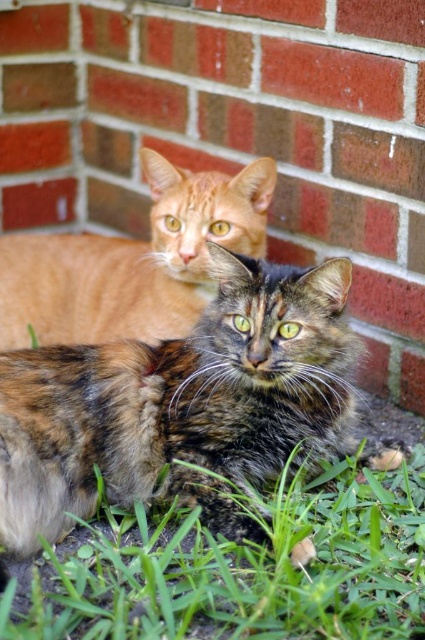
Is green grass at lower center positioned at the back of orange fur cat at upper center?

No, green grass at lower center is in front of orange fur cat at upper center.

Where is `green grass at lower center`? The height and width of the screenshot is (640, 425). green grass at lower center is located at coordinates (x=238, y=570).

Can you confirm if calico fur cat at center is smaller than orange fur cat at upper center?

No, calico fur cat at center is not smaller than orange fur cat at upper center.

Which is more to the left, calico fur cat at center or orange fur cat at upper center?

orange fur cat at upper center is more to the left.

You are a GUI agent. You are given a task and a screenshot of the screen. Output one action in this format:
    pyautogui.click(x=<x>, y=<y>)
    Task: Click on the calico fur cat at center
    The width and height of the screenshot is (425, 640).
    Given the screenshot: What is the action you would take?
    pyautogui.click(x=183, y=404)

Which is behind, point (112, 378) or point (249, 608)?

The point (112, 378) is more distant.

Can you confirm if calico fur cat at center is positioned to the left of green grass at lower center?

Correct, you'll find calico fur cat at center to the left of green grass at lower center.

Is point (45, 388) positioned in front of point (223, 577)?

No, (45, 388) is further to viewer.

Locate an element on the screen. The image size is (425, 640). calico fur cat at center is located at coordinates (183, 404).